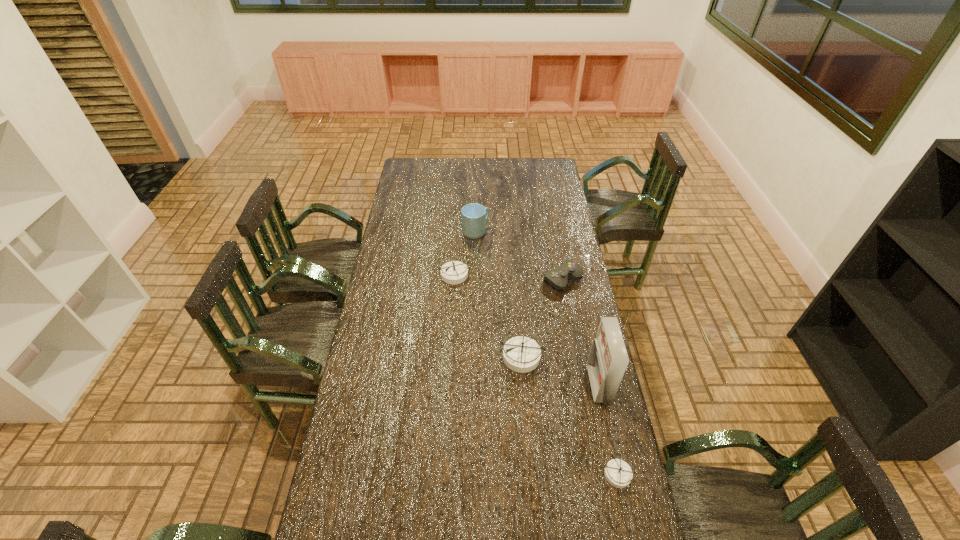
Where is `vacant area that lies between the third shortest object and the shortest compass`? This screenshot has height=540, width=960. vacant area that lies between the third shortest object and the shortest compass is located at coordinates [x=537, y=374].

Identify the location of blank region between the second nearest compass and the mug. The image size is (960, 540). (498, 294).

At what (x,y) coordinates should I click in order to perform the action: click on vacant point located between the leftmost compass and the farthest object. Please return your answer as a coordinate pair (x, y). Image resolution: width=960 pixels, height=540 pixels. Looking at the image, I should click on (465, 253).

This screenshot has width=960, height=540. I want to click on empty space between the first-aid kit and the farthest compass, so click(x=526, y=329).

Find the location of `free point between the mug and the control`. free point between the mug and the control is located at coordinates pyautogui.click(x=519, y=255).

Where is `free spot between the shortest compass and the second tallest object`? free spot between the shortest compass and the second tallest object is located at coordinates (547, 353).

This screenshot has height=540, width=960. In order to click on the third closest object to the shortest compass in this screenshot , I will do `click(558, 278)`.

Choose which object is the third nearest neighbor to the control. Please provide its 2D coordinates. Your answer should be formatted as a tuple, i.e. [(x, y)], where the tuple contains the x and y coordinates of a point satisfying the conditions above.

[(454, 272)]

Identify which compass is located as the second nearest to the first-aid kit. Please provide its 2D coordinates. Your answer should be formatted as a tuple, i.e. [(x, y)], where the tuple contains the x and y coordinates of a point satisfying the conditions above.

[(618, 473)]

I want to click on compass object that ranks as the second closest to the control, so click(454, 272).